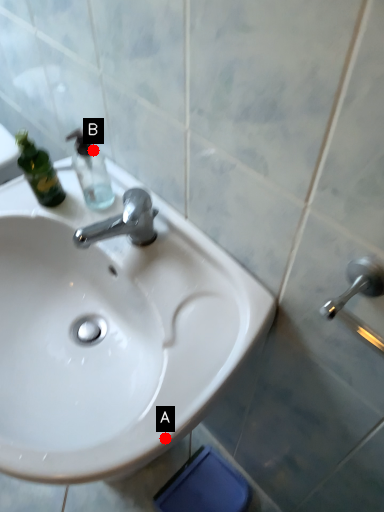
Question: Two points are circled on the image, labeled by A and B beside each circle. Which point is further to the camera?

Choices:
 (A) A is further
 (B) B is further

Answer: (B)